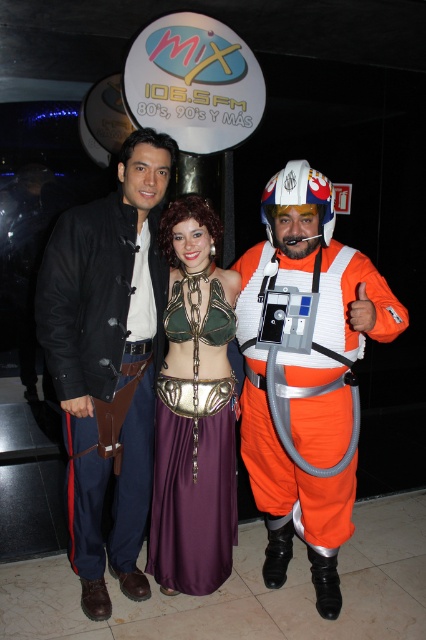
Question: Does metallic chainmail bikini top at center appear over orange fabric spacesuit at center?

Choices:
 (A) yes
 (B) no

Answer: (A)

Question: Considering the real-world distances, which object is farthest from the orange fabric spacesuit at center?

Choices:
 (A) metallic green armor at center
 (B) metallic chainmail bikini top at center
 (C) black leather jacket at center

Answer: (C)

Question: Does black leather jacket at center have a lesser width compared to metallic green armor at center?

Choices:
 (A) yes
 (B) no

Answer: (B)

Question: Is orange fabric spacesuit at center above metallic green armor at center?

Choices:
 (A) yes
 (B) no

Answer: (A)

Question: Based on their relative distances, which object is nearer to the orange fabric spacesuit at center?

Choices:
 (A) black leather jacket at center
 (B) metallic green armor at center

Answer: (B)

Question: Which object appears farthest from the camera in this image?

Choices:
 (A) metallic chainmail bikini top at center
 (B) orange fabric spacesuit at center
 (C) black leather jacket at center

Answer: (C)